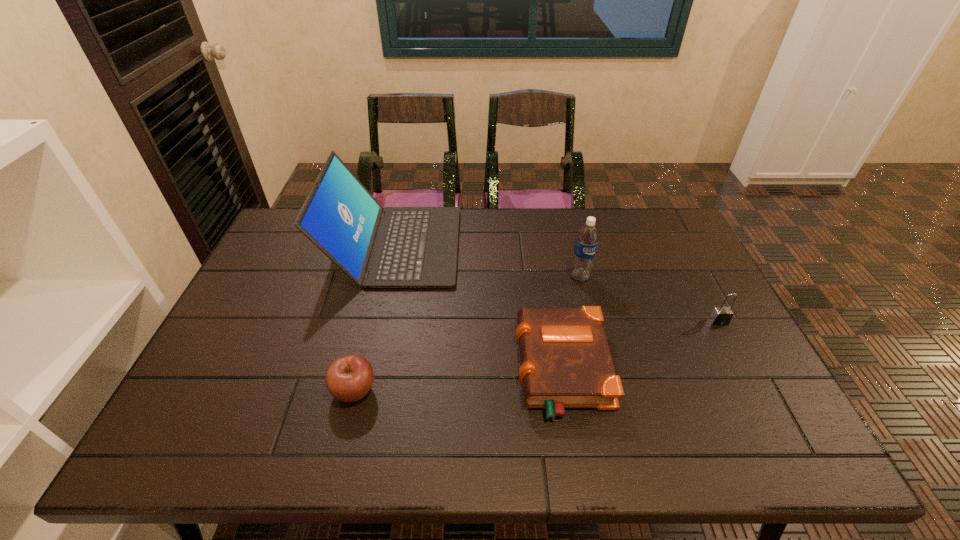
The height and width of the screenshot is (540, 960). In order to click on laptop computer in this screenshot , I will do `click(392, 247)`.

Find the location of a particular element. The width and height of the screenshot is (960, 540). water bottle is located at coordinates (587, 238).

I want to click on the rightmost object, so click(721, 315).

This screenshot has width=960, height=540. Find the location of `apple`. apple is located at coordinates (349, 378).

Where is `the shortest object`? the shortest object is located at coordinates (565, 360).

Locate an element on the screen. free space located 0.130m on the screen of the laptop computer is located at coordinates (497, 246).

At what (x,y) coordinates should I click in order to perform the action: click on vacant region located on the front of the water bottle. Please return your answer as a coordinate pair (x, y). This screenshot has width=960, height=540. Looking at the image, I should click on (592, 330).

Image resolution: width=960 pixels, height=540 pixels. Identify the location of free region located 0.140m on the shackle of the padlock. (743, 368).

Image resolution: width=960 pixels, height=540 pixels. Find the location of `vacant region located 0.050m on the side of the apple with the unique marking`. vacant region located 0.050m on the side of the apple with the unique marking is located at coordinates (397, 390).

Find the location of a particular element. The width and height of the screenshot is (960, 540). vacant area situated on the spine side of the Bible is located at coordinates (369, 369).